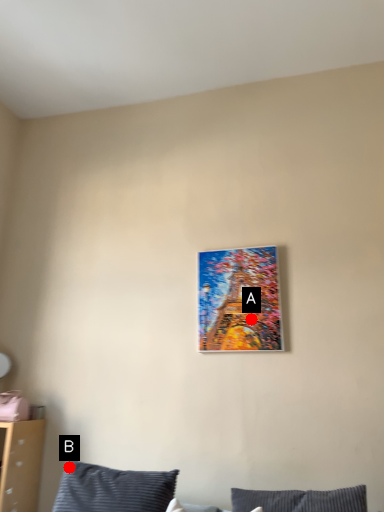
Question: Two points are circled on the image, labeled by A and B beside each circle. Which point is closer to the camera?

Choices:
 (A) A is closer
 (B) B is closer

Answer: (B)